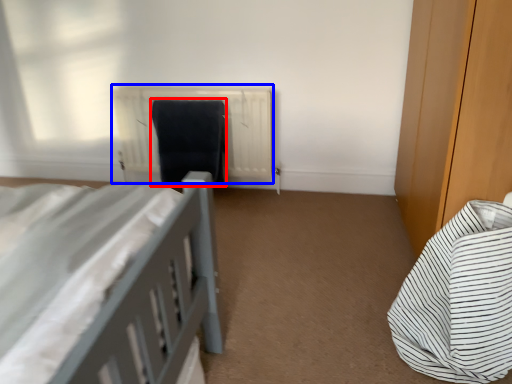
Question: Which object appears closest to the camera in this image, laundry (highlighted by a red box) or radiator (highlighted by a blue box)?

Choices:
 (A) laundry
 (B) radiator

Answer: (A)